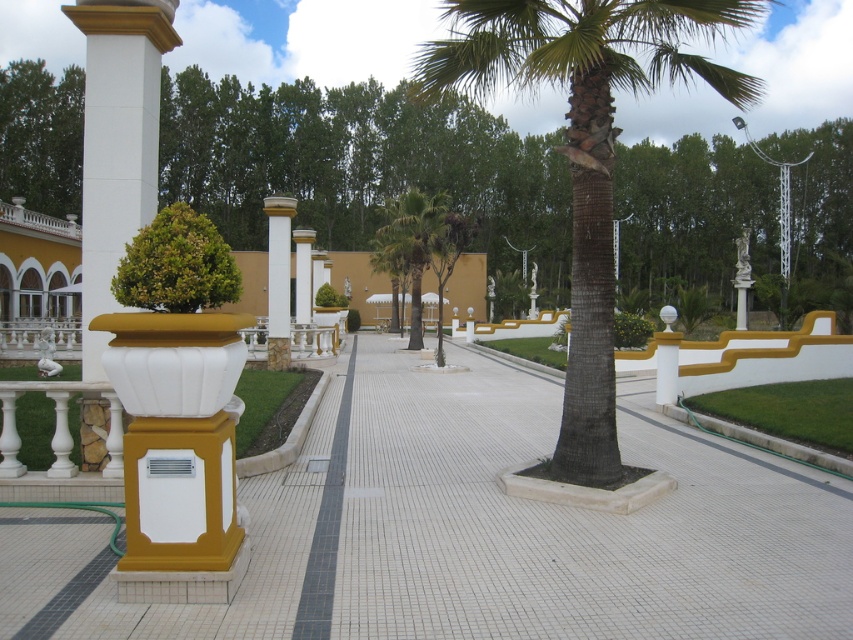
Question: Does brown textured palm tree at center appear over green leafy palm tree at center?

Choices:
 (A) yes
 (B) no

Answer: (A)

Question: From the image, what is the correct spatial relationship of white glossy column at left in relation to green leafy palm tree at center?

Choices:
 (A) below
 (B) above

Answer: (A)

Question: Which point appears farthest from the camera in this image?

Choices:
 (A) (477, 504)
 (B) (311, 266)
 (C) (447, 230)
 (D) (341, 499)

Answer: (B)

Question: Estimate the real-world distances between objects in this image. Which object is farther from the black tile line at center?

Choices:
 (A) white glossy pillar at center
 (B) brown textured palm tree at center

Answer: (B)

Question: Can you confirm if green leafy palm tree at center is wider than white glossy pillar at center?

Choices:
 (A) yes
 (B) no

Answer: (A)

Question: Considering the real-world distances, which object is farthest from the white glossy column at left?

Choices:
 (A) green leafy palm tree at center
 (B) white marble column at center

Answer: (A)